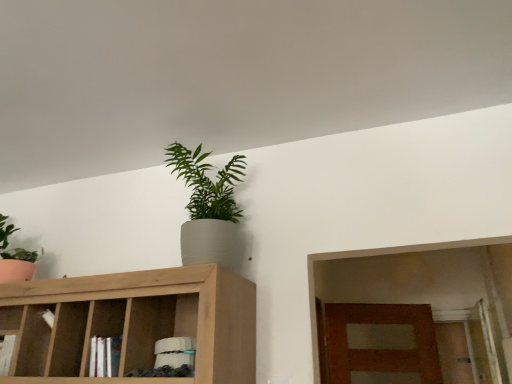
Question: Which direction should I rotate to look at green matte plant at upper center, which is counted as the first houseplant, starting from the right?

Choices:
 (A) left
 (B) right

Answer: (A)

Question: Can you confirm if light brown wood cabinet at upper center is bigger than matte green plant at left, the first houseplant when ordered from left to right?

Choices:
 (A) yes
 (B) no

Answer: (A)

Question: From a real-world perspective, is light brown wood cabinet at upper center located beneath matte green plant at left, which is counted as the second houseplant, starting from the right?

Choices:
 (A) yes
 (B) no

Answer: (A)

Question: Does light brown wood cabinet at upper center have a greater width compared to matte green plant at left, which is counted as the second houseplant, starting from the right?

Choices:
 (A) no
 (B) yes

Answer: (B)

Question: Are light brown wood cabinet at upper center and matte green plant at left, which is counted as the second houseplant, starting from the right, beside each other?

Choices:
 (A) no
 (B) yes

Answer: (A)

Question: Does light brown wood cabinet at upper center turn towards matte green plant at left, the first houseplant when ordered from left to right?

Choices:
 (A) yes
 (B) no

Answer: (B)

Question: From the image's perspective, is light brown wood cabinet at upper center over matte green plant at left, which is counted as the second houseplant, starting from the right?

Choices:
 (A) no
 (B) yes

Answer: (A)

Question: From the image's perspective, would you say green matte plant at upper center, which is counted as the first houseplant, starting from the right, is positioned over matte green plant at left, the first houseplant when ordered from left to right?

Choices:
 (A) no
 (B) yes

Answer: (B)

Question: Is green matte plant at upper center, which appears as the second houseplant when viewed from the left, wider than matte green plant at left, which is counted as the second houseplant, starting from the right?

Choices:
 (A) yes
 (B) no

Answer: (A)

Question: Is green matte plant at upper center, which is counted as the first houseplant, starting from the right, facing away from matte green plant at left, the first houseplant when ordered from left to right?

Choices:
 (A) no
 (B) yes

Answer: (A)

Question: Is green matte plant at upper center, which appears as the second houseplant when viewed from the left, outside matte green plant at left, which is counted as the second houseplant, starting from the right?

Choices:
 (A) yes
 (B) no

Answer: (A)

Question: Does green matte plant at upper center, which is counted as the first houseplant, starting from the right, contain matte green plant at left, the first houseplant when ordered from left to right?

Choices:
 (A) no
 (B) yes

Answer: (A)

Question: Is green matte plant at upper center, which appears as the second houseplant when viewed from the left, at the right side of matte green plant at left, which is counted as the second houseplant, starting from the right?

Choices:
 (A) no
 (B) yes

Answer: (B)

Question: Does green matte plant at upper center, which appears as the second houseplant when viewed from the left, have a larger size compared to light brown wood cabinet at upper center?

Choices:
 (A) yes
 (B) no

Answer: (B)